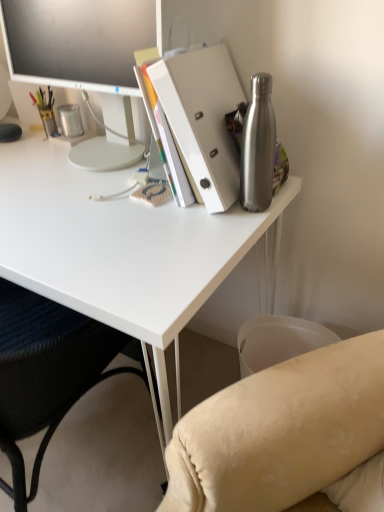
Question: Should I look upward or downward to see white matte desk at upper center?

Choices:
 (A) up
 (B) down

Answer: (B)

Question: Considering the relative sizes of white glossy monitor at upper left and brushed metal water bottle at right in the image provided, is white glossy monitor at upper left shorter than brushed metal water bottle at right?

Choices:
 (A) yes
 (B) no

Answer: (B)

Question: Does white glossy monitor at upper left lie behind brushed metal water bottle at right?

Choices:
 (A) no
 (B) yes

Answer: (B)

Question: From the image's perspective, is white glossy monitor at upper left located beneath brushed metal water bottle at right?

Choices:
 (A) no
 (B) yes

Answer: (A)

Question: Is white glossy monitor at upper left oriented away from brushed metal water bottle at right?

Choices:
 (A) no
 (B) yes

Answer: (A)

Question: Considering the relative sizes of white glossy monitor at upper left and brushed metal water bottle at right in the image provided, is white glossy monitor at upper left smaller than brushed metal water bottle at right?

Choices:
 (A) yes
 (B) no

Answer: (B)

Question: Is white glossy monitor at upper left touching brushed metal water bottle at right?

Choices:
 (A) no
 (B) yes

Answer: (A)

Question: From a real-world perspective, is white matte desk at upper center positioned under white matte folder at upper right based on gravity?

Choices:
 (A) no
 (B) yes

Answer: (B)

Question: Does white matte desk at upper center appear on the right side of white matte folder at upper right?

Choices:
 (A) no
 (B) yes

Answer: (A)

Question: From the image's perspective, is white matte desk at upper center over white matte folder at upper right?

Choices:
 (A) yes
 (B) no

Answer: (B)

Question: Considering the relative sizes of white matte desk at upper center and white matte folder at upper right in the image provided, is white matte desk at upper center bigger than white matte folder at upper right?

Choices:
 (A) no
 (B) yes

Answer: (B)

Question: Is white matte desk at upper center not near white matte folder at upper right?

Choices:
 (A) no
 (B) yes

Answer: (A)

Question: Does white matte desk at upper center lie behind white matte folder at upper right?

Choices:
 (A) no
 (B) yes

Answer: (A)

Question: Is white matte folder at upper right a part of metallic silver pen holder at left?

Choices:
 (A) no
 (B) yes

Answer: (A)